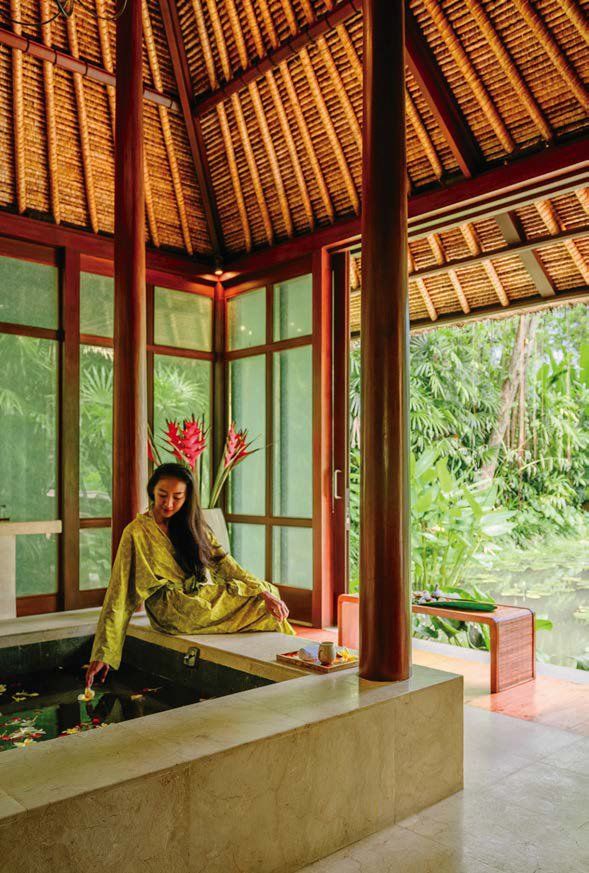
Find the location of a particular element. The height and width of the screenshot is (873, 589). pillar is located at coordinates (397, 622).